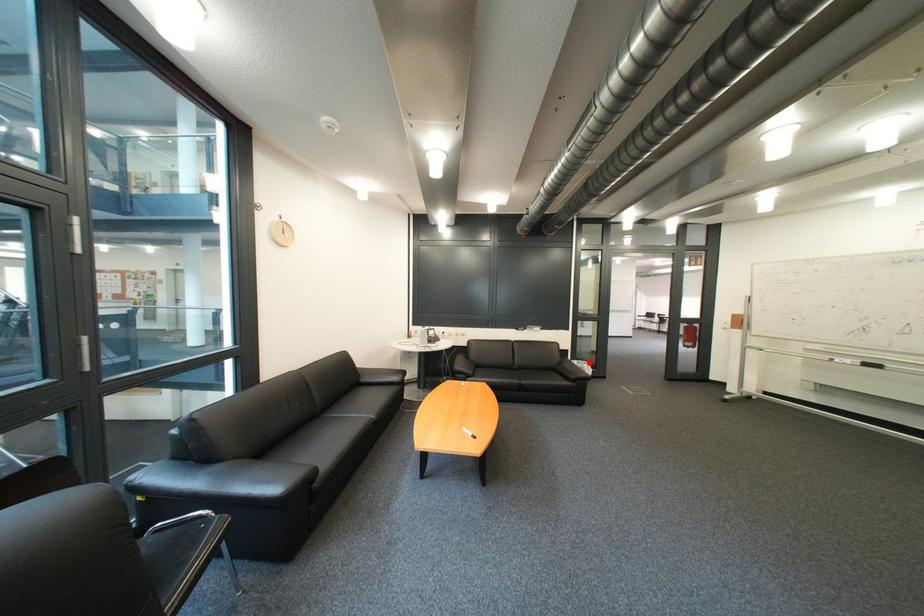
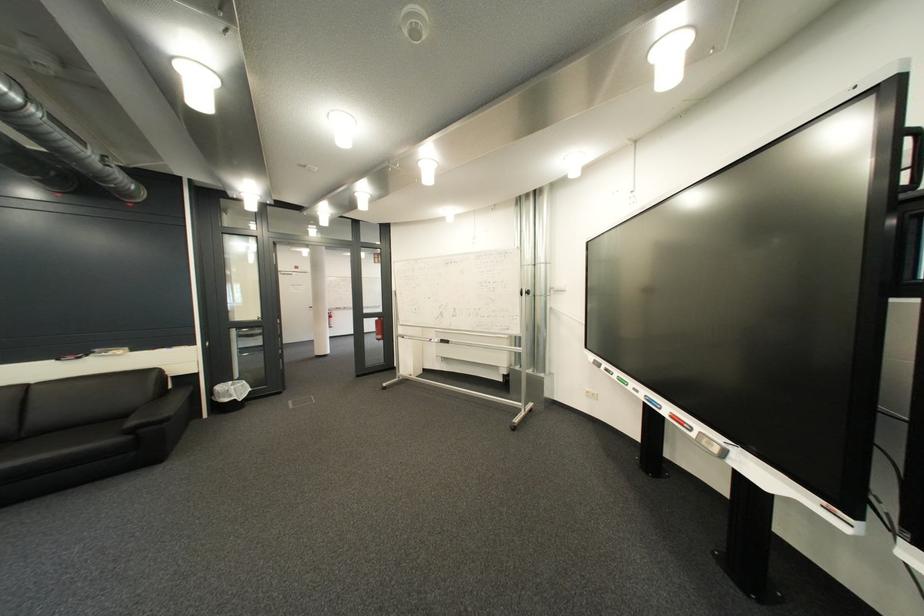
Question: I am providing you with two images of the same scene from different viewpoints. Given a red point in image1, look at the same physical point in image2. Is it:

Choices:
 (A) Closer to the viewpoint
 (B) Farther from the viewpoint

Answer: (A)